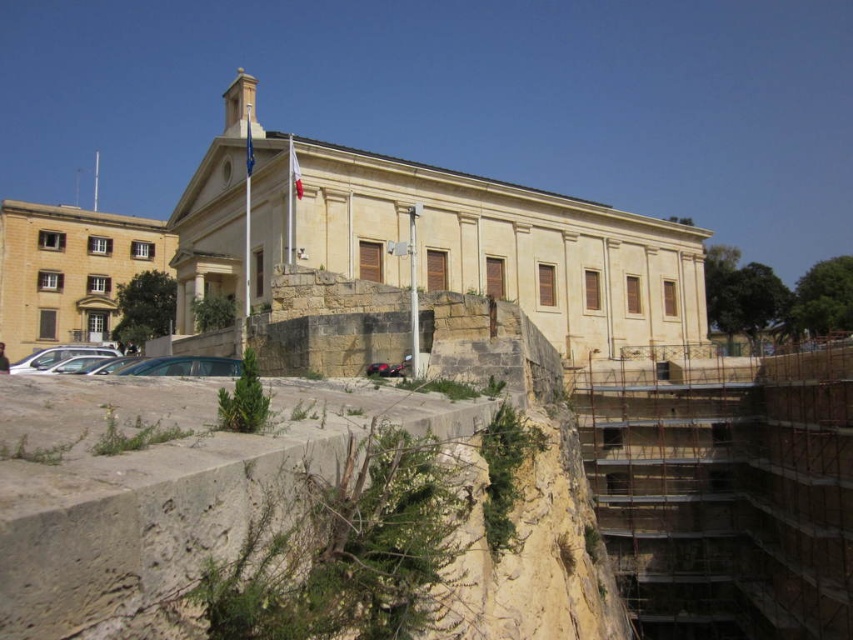
Question: Is metallic silver car at lower left positioned at the back of silver metallic car at lower left?

Choices:
 (A) no
 (B) yes

Answer: (A)

Question: Does metallic silver car at lower left lie behind silver metallic car at lower left?

Choices:
 (A) yes
 (B) no

Answer: (B)

Question: Can you confirm if metallic silver car at lower left is positioned to the right of silver metallic car at lower left?

Choices:
 (A) no
 (B) yes

Answer: (B)

Question: Which of the following is the closest to the observer?

Choices:
 (A) silver metallic car at lower left
 (B) metallic silver car at lower left

Answer: (B)